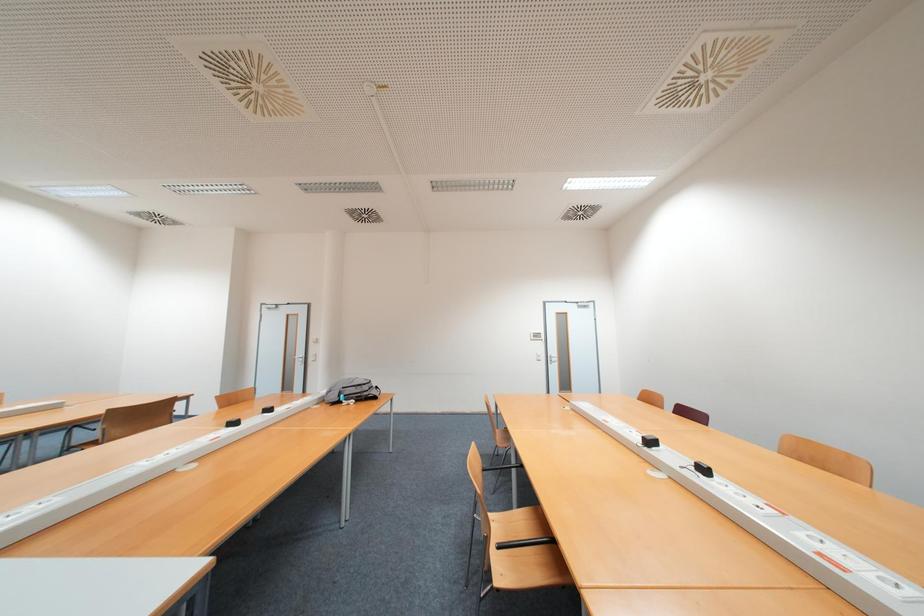
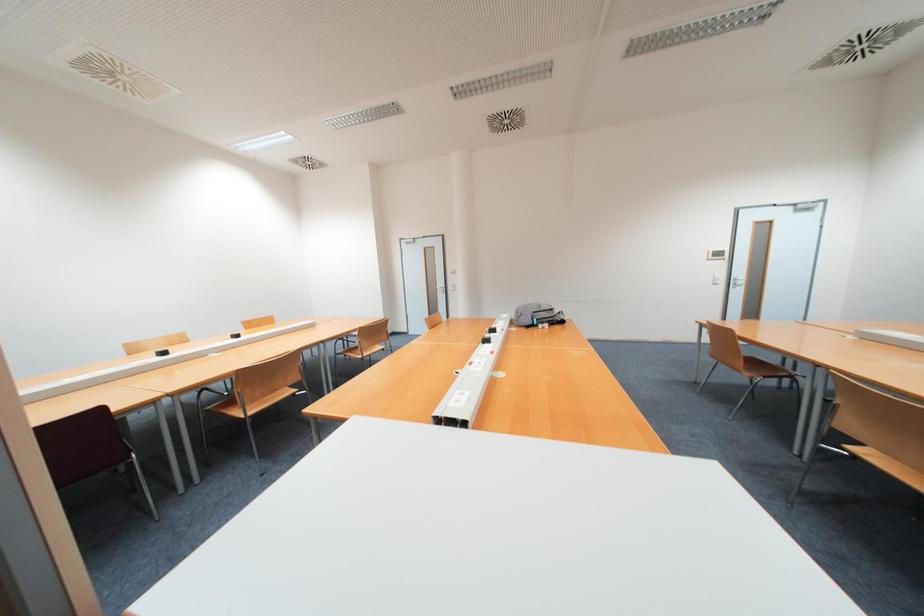
Question: The images are taken continuously from a first-person perspective. In which direction are you moving?

Choices:
 (A) Left
 (B) Right
 (C) Forward
 (D) Backward

Answer: (A)